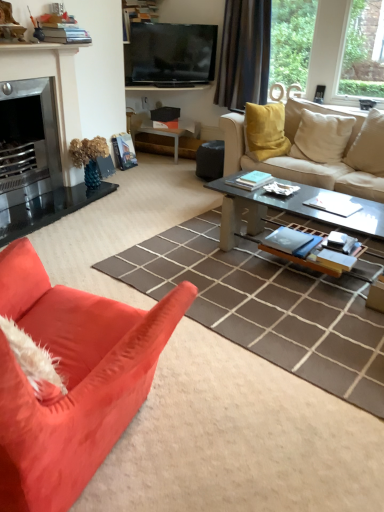
Question: Can you confirm if matte white side table at center is shorter than brushed metal fireplace at left?

Choices:
 (A) yes
 (B) no

Answer: (A)

Question: Is matte white side table at center facing towards brushed metal fireplace at left?

Choices:
 (A) no
 (B) yes

Answer: (A)

Question: Does matte white side table at center appear on the left side of brushed metal fireplace at left?

Choices:
 (A) yes
 (B) no

Answer: (B)

Question: Is matte white side table at center next to brushed metal fireplace at left?

Choices:
 (A) yes
 (B) no

Answer: (B)

Question: Is the depth of matte white side table at center less than that of brushed metal fireplace at left?

Choices:
 (A) no
 (B) yes

Answer: (A)

Question: Does matte white side table at center lie behind brushed metal fireplace at left?

Choices:
 (A) no
 (B) yes

Answer: (B)

Question: Is clear glass coffee table at center with flat screen tv at upper center?

Choices:
 (A) yes
 (B) no

Answer: (B)

Question: Considering the relative positions of clear glass coffee table at center and flat screen tv at upper center in the image provided, is clear glass coffee table at center in front of flat screen tv at upper center?

Choices:
 (A) no
 (B) yes

Answer: (B)

Question: From the image's perspective, is clear glass coffee table at center below flat screen tv at upper center?

Choices:
 (A) yes
 (B) no

Answer: (A)

Question: Is clear glass coffee table at center oriented away from flat screen tv at upper center?

Choices:
 (A) yes
 (B) no

Answer: (B)

Question: Considering the relative positions of clear glass coffee table at center and flat screen tv at upper center in the image provided, is clear glass coffee table at center to the left of flat screen tv at upper center from the viewer's perspective?

Choices:
 (A) yes
 (B) no

Answer: (B)

Question: Is there a large distance between clear glass coffee table at center and flat screen tv at upper center?

Choices:
 (A) no
 (B) yes

Answer: (B)

Question: Is flat screen tv at upper center to the right of matte white side table at center from the viewer's perspective?

Choices:
 (A) no
 (B) yes

Answer: (B)